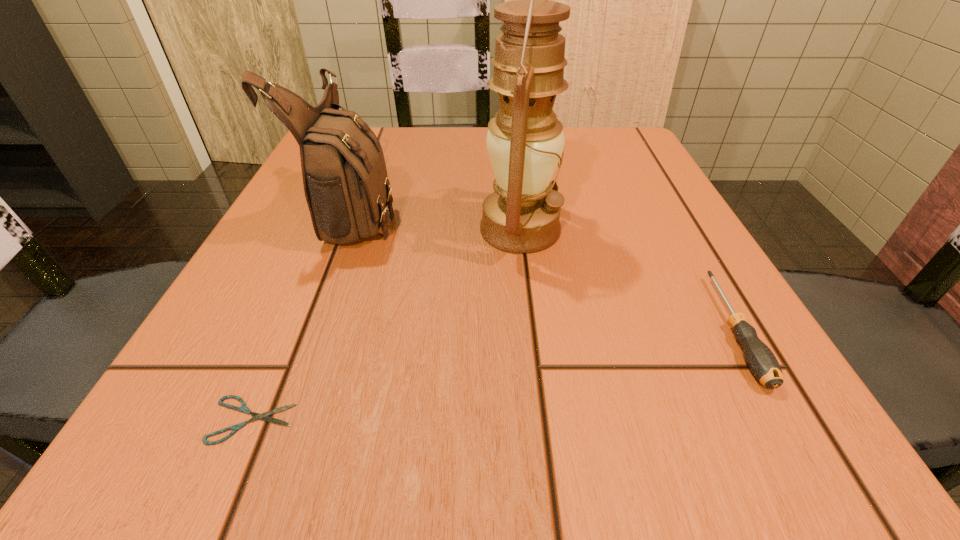
I want to click on vacant position in the image that satisfies the following two spatial constraints: 1. on the front-facing side of the shoulder bag; 2. on the right side of the third farthest object, so click(312, 329).

This screenshot has width=960, height=540. Identify the location of free spot that satisfies the following two spatial constraints: 1. on the front-facing side of the second tallest object; 2. on the right side of the rightmost object. (312, 329).